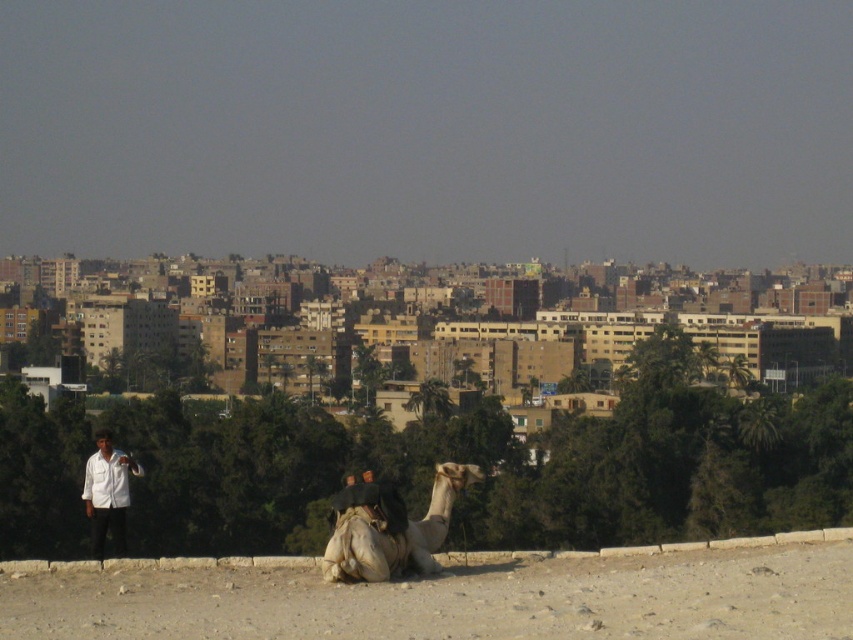
You are a traveler in this Middle Eastern city scene. You need to determine which object takes up more visual space in the image between the light beige textured camel at center and the white matte shirt at left. Which one is larger in the image?

The light beige textured camel at center occupies less space than the white matte shirt at left, so the white matte shirt at left is larger in the image.

You are a photographer positioned at the center of the image. You want to capture a photo that includes the beige sand camel at lower center while ensuring the camel is not cropped out. Given the camera has a 60 degree field of view, can you determine if the camel is within the camera frame?

The beige sand camel at lower center is located at point (457, 600) in the image. Since the photographer is at the center, the camel is positioned towards the lower right edge of the frame. With a 60 degree field of view, the camera can capture objects within this angle. The camel is within the 60 degree field of view, so it will be included in the photo without being cropped out.

You are a traveler who wants to ride a camel that is taller than the other. Which camel should you choose between the beige sand camel at lower center and the light beige textured camel at center?

The light beige textured camel at center is taller than the beige sand camel at lower center, so you should choose the light beige textured camel at center.